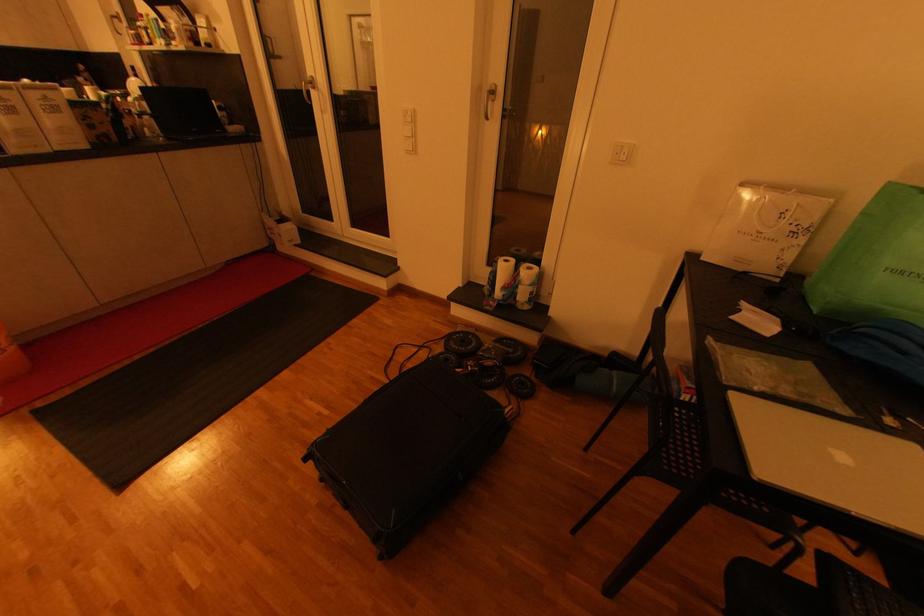
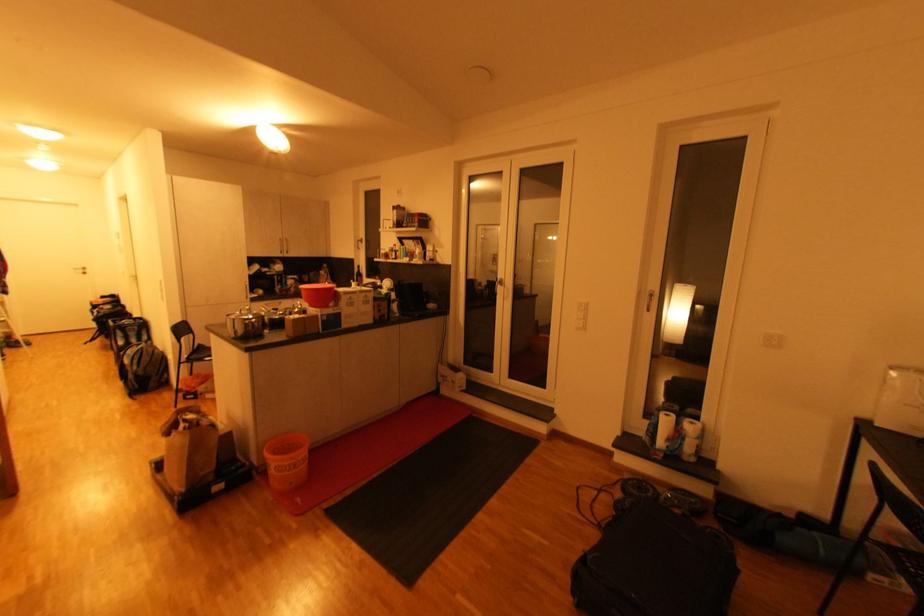
The point at (503, 294) is marked in the first image. Where is the corresponding point in the second image?

(665, 444)